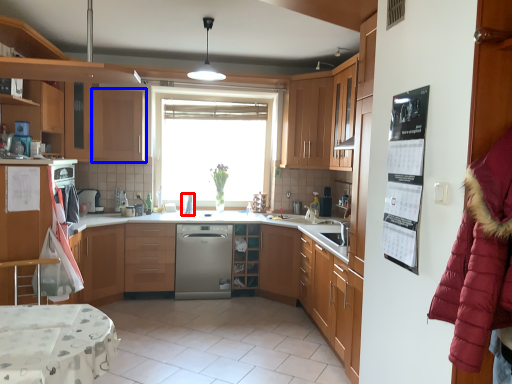
Question: Which point is closer to the camera, appliance (highlighted by a red box) or cabinetry (highlighted by a blue box)?

Choices:
 (A) appliance
 (B) cabinetry

Answer: (B)